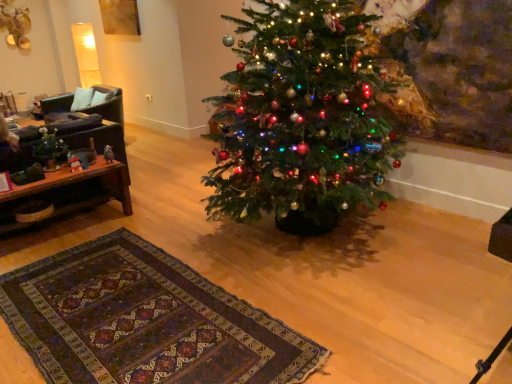
Question: Is brown wooden table at left oriented away from black leather armchair at left?

Choices:
 (A) no
 (B) yes

Answer: (B)

Question: Can you confirm if brown wooden table at left is positioned to the right of black leather armchair at left?

Choices:
 (A) yes
 (B) no

Answer: (A)

Question: From a real-world perspective, is brown wooden table at left on top of black leather armchair at left?

Choices:
 (A) yes
 (B) no

Answer: (B)

Question: From a real-world perspective, is brown wooden table at left physically below black leather armchair at left?

Choices:
 (A) yes
 (B) no

Answer: (A)

Question: Is brown wooden table at left closer to the viewer compared to black leather armchair at left?

Choices:
 (A) yes
 (B) no

Answer: (A)

Question: From their relative heights in the image, would you say matte black vase at left is taller or shorter than black leather armchair at left?

Choices:
 (A) short
 (B) tall

Answer: (A)

Question: From a real-world perspective, is matte black vase at left above or below black leather armchair at left?

Choices:
 (A) below
 (B) above

Answer: (B)

Question: Does point (65, 152) appear closer or farther from the camera than point (99, 105)?

Choices:
 (A) closer
 (B) farther

Answer: (A)

Question: Would you say matte black vase at left is to the left or to the right of black leather armchair at left in the picture?

Choices:
 (A) left
 (B) right

Answer: (B)

Question: From the image's perspective, is matte black vase at left positioned above or below brown wooden table at left?

Choices:
 (A) below
 (B) above

Answer: (B)

Question: From a real-world perspective, is matte black vase at left above or below brown wooden table at left?

Choices:
 (A) below
 (B) above

Answer: (B)

Question: Is matte black vase at left bigger or smaller than brown wooden table at left?

Choices:
 (A) small
 (B) big

Answer: (A)

Question: In terms of width, does matte black vase at left look wider or thinner when compared to brown wooden table at left?

Choices:
 (A) wide
 (B) thin

Answer: (B)

Question: Is black leather armchair at left inside the boundaries of brown wooden table at left, or outside?

Choices:
 (A) outside
 (B) inside

Answer: (A)

Question: In the image, is black leather armchair at left on the left side or the right side of brown wooden table at left?

Choices:
 (A) right
 (B) left

Answer: (B)